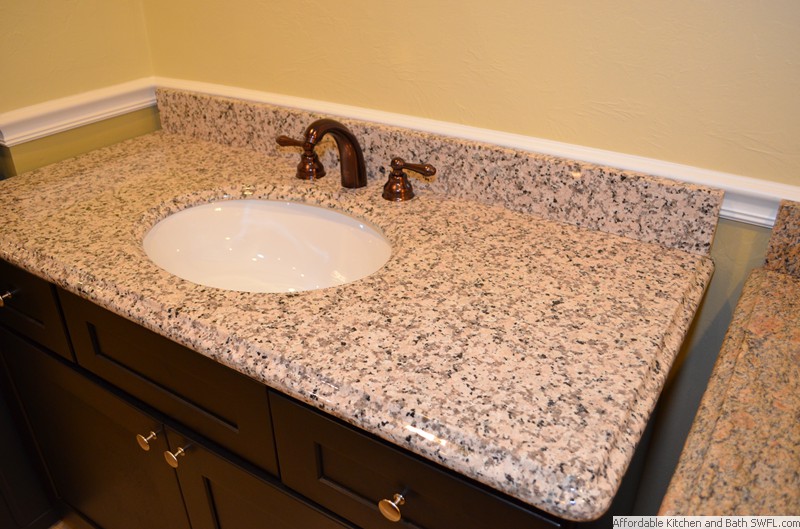
The width and height of the screenshot is (800, 529). Find the location of `faux drawer`. faux drawer is located at coordinates (222, 422).